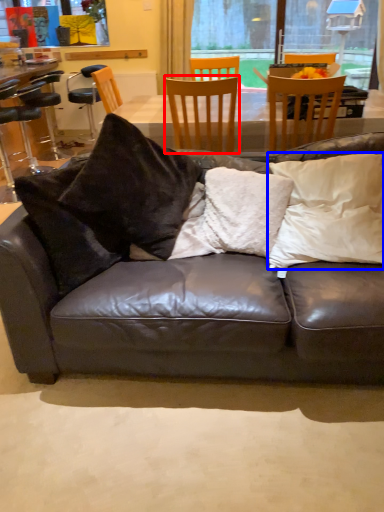
Question: Among these objects, which one is nearest to the camera, chair (highlighted by a red box) or pillow (highlighted by a blue box)?

Choices:
 (A) chair
 (B) pillow

Answer: (B)